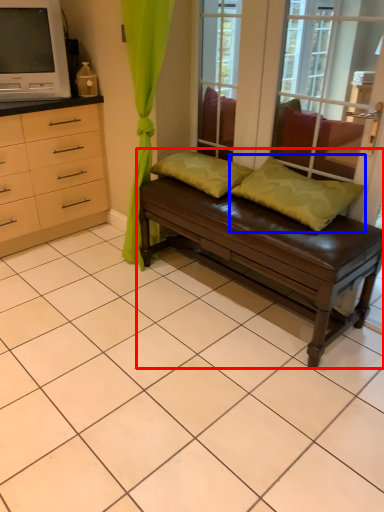
Question: Which of the following is the closest to the observer, studio couch (highlighted by a red box) or pillow (highlighted by a blue box)?

Choices:
 (A) studio couch
 (B) pillow

Answer: (A)